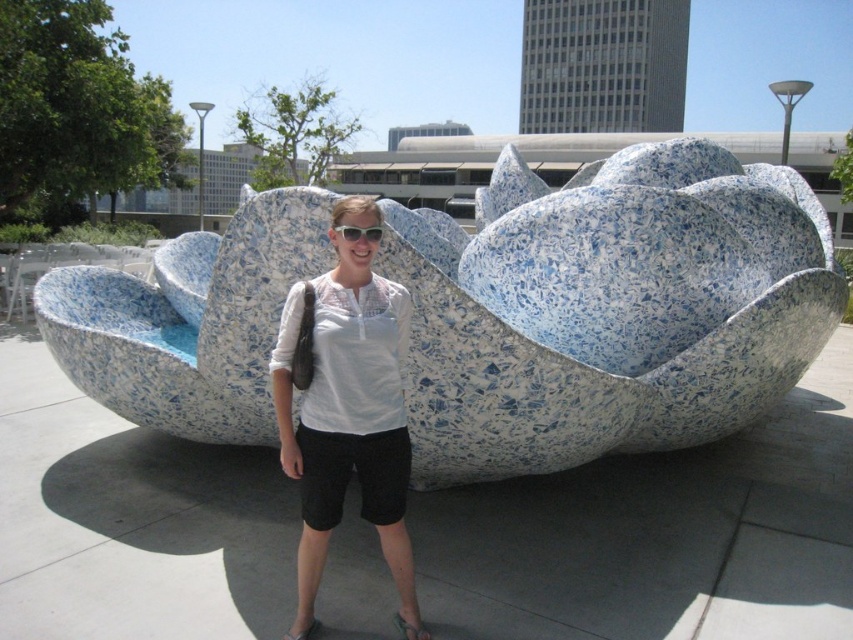
Question: Which of the following is the closest to the observer?

Choices:
 (A) pyautogui.click(x=689, y=340)
 (B) pyautogui.click(x=357, y=234)
 (C) pyautogui.click(x=294, y=467)

Answer: (B)

Question: From the image, what is the correct spatial relationship of blue speckled stone flower at center in relation to white plastic sunglasses at center?

Choices:
 (A) right
 (B) left

Answer: (A)

Question: Does white lace shirt at center have a larger size compared to white plastic sunglasses at center?

Choices:
 (A) no
 (B) yes

Answer: (B)

Question: Which object is closer to the camera taking this photo?

Choices:
 (A) white plastic sunglasses at center
 (B) white lace shirt at center

Answer: (B)

Question: Can you confirm if white lace shirt at center is bigger than white plastic sunglasses at center?

Choices:
 (A) yes
 (B) no

Answer: (A)

Question: Which of the following is the closest to the observer?

Choices:
 (A) (341, 230)
 (B) (366, 484)
 (C) (184, 253)

Answer: (A)